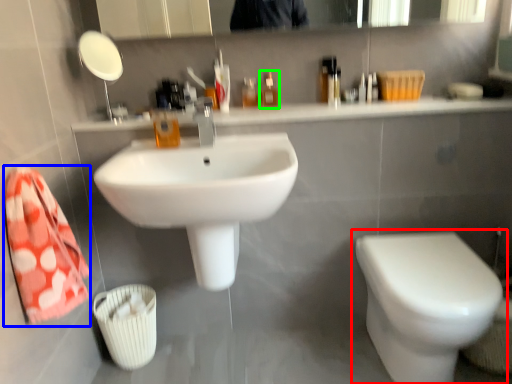
Question: Which object is the farthest from toilet (highlighted by a red box)? Choose among these: bath towel (highlighted by a blue box) or mouthwash (highlighted by a green box).

Choices:
 (A) bath towel
 (B) mouthwash

Answer: (A)